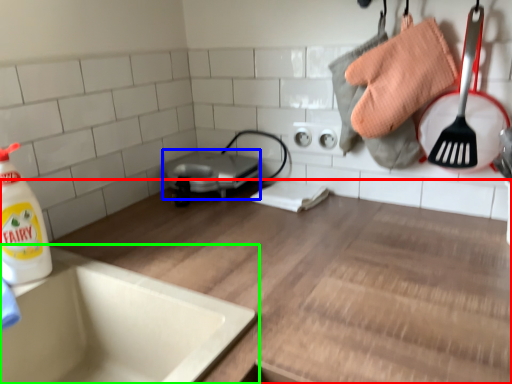
Question: Which object is the closest to the countertop (highlighted by a red box)? Choose among these: appliance (highlighted by a blue box) or sink (highlighted by a green box).

Choices:
 (A) appliance
 (B) sink

Answer: (B)